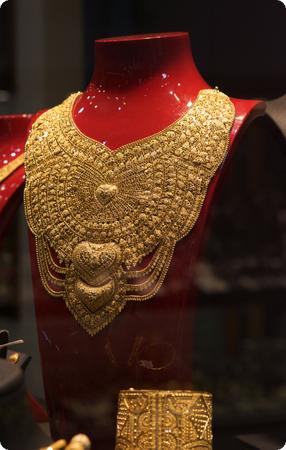
Find the location of a particular element. The width and height of the screenshot is (286, 450). headless mannequin is located at coordinates (138, 43), (14, 116), (283, 96).